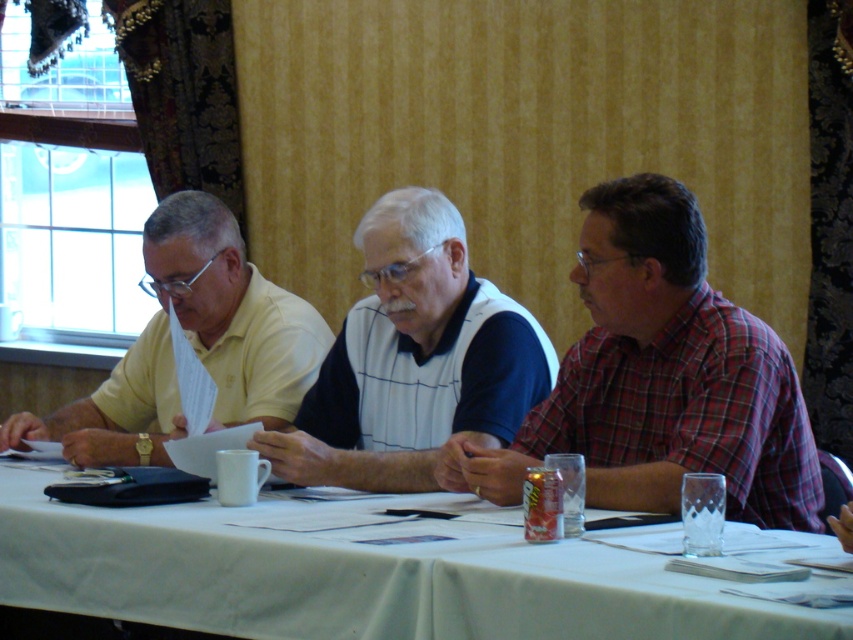
Question: Can you confirm if white cloth table at center is smaller than yellow matte shirt at left?

Choices:
 (A) yes
 (B) no

Answer: (B)

Question: Which of the following is the farthest from the observer?

Choices:
 (A) 531,420
 (B) 405,243

Answer: (B)

Question: Can you confirm if white cloth table at center is wider than yellow matte shirt at left?

Choices:
 (A) no
 (B) yes

Answer: (B)

Question: Which object is farther from the camera taking this photo?

Choices:
 (A) yellow matte shirt at left
 (B) white cloth table at center

Answer: (A)

Question: Is white cloth table at center further to the viewer compared to red plaid shirt at right?

Choices:
 (A) no
 (B) yes

Answer: (A)

Question: Among these objects, which one is farthest from the camera?

Choices:
 (A) yellow matte shirt at left
 (B) white cloth table at center

Answer: (A)